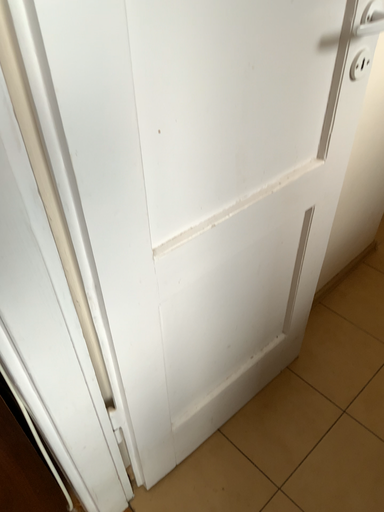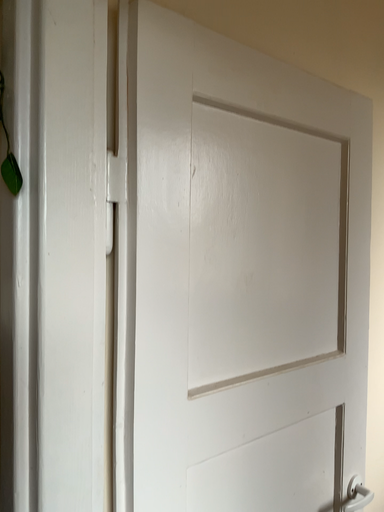
Question: Which way did the camera rotate in the video?

Choices:
 (A) rotated downward
 (B) rotated upward

Answer: (B)